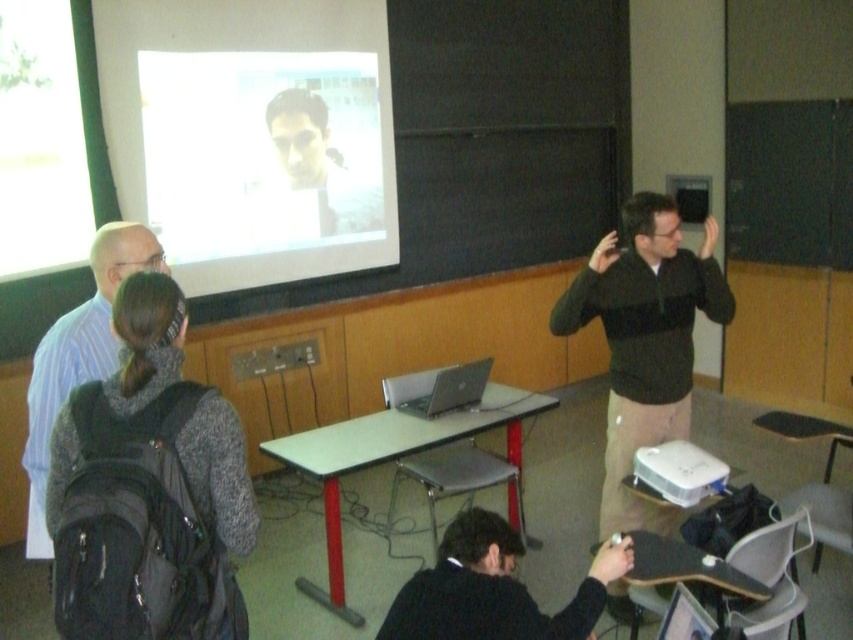
You are a student in the classroom and need to reach the blackboard at the front. You have a dark gray backpack at left and a black matte jacket at lower center in your way. Which item is taller and might block your view?

The dark gray backpack at left is much taller than the black matte jacket at lower center, so it might block your view more.